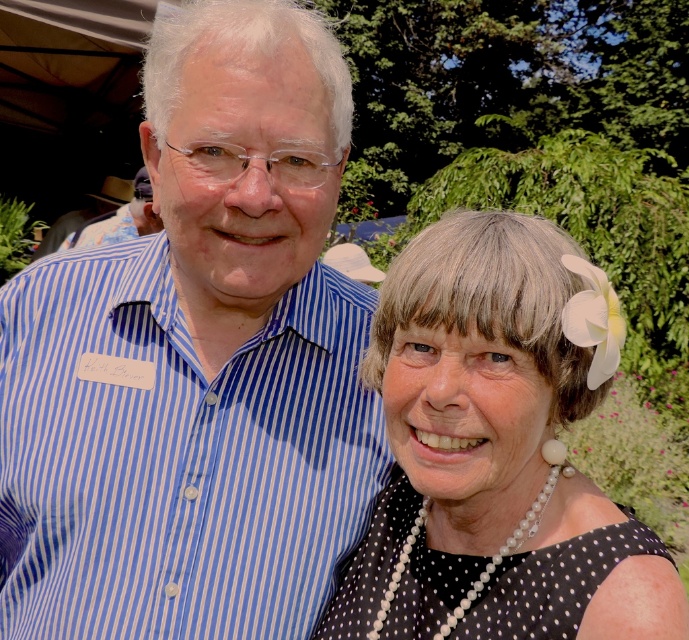
Between point (25, 552) and point (466, 360), which one is positioned behind?

Positioned behind is point (25, 552).

Does blue striped shirt at left appear on the right side of black dotted dress at center?

Incorrect, blue striped shirt at left is not on the right side of black dotted dress at center.

Which is behind, point (294, 310) or point (469, 541)?

The point (294, 310) is more distant.

Identify the location of blue striped shirt at left. The width and height of the screenshot is (689, 640). (176, 452).